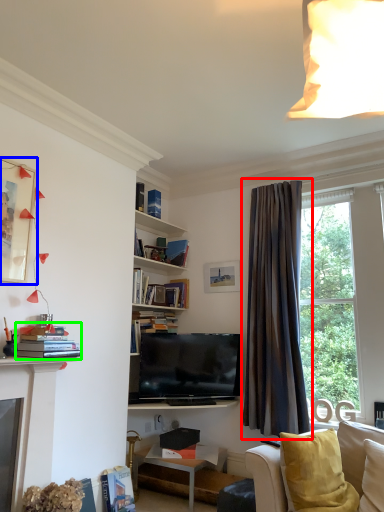
Question: Considering the real-world distances, which object is closest to curtain (highlighted by a red box)? picture frame (highlighted by a blue box) or book (highlighted by a green box).

Choices:
 (A) picture frame
 (B) book

Answer: (B)